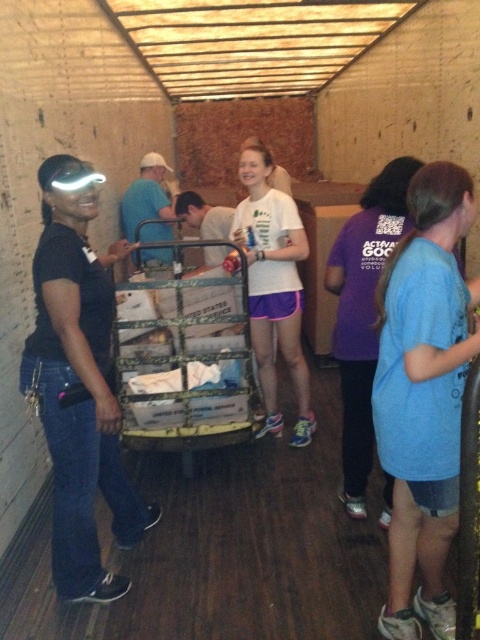
From the picture: You are a delivery person who needs to carry a heavy package. You see a matte black shirt at left and a camouflage metal trolley at center. Which item is more suitable for carrying the package?

The camouflage metal trolley at center is more suitable for carrying the package because it is larger than the matte black shirt at left.

You are standing in the storage area and need to determine which of the two points, point (248, 433) or point (292, 371), is closer to you. Based on the scene description, which point is nearer?

Point (248, 433) is closer to the camera than point (292, 371), so it is the nearer point.